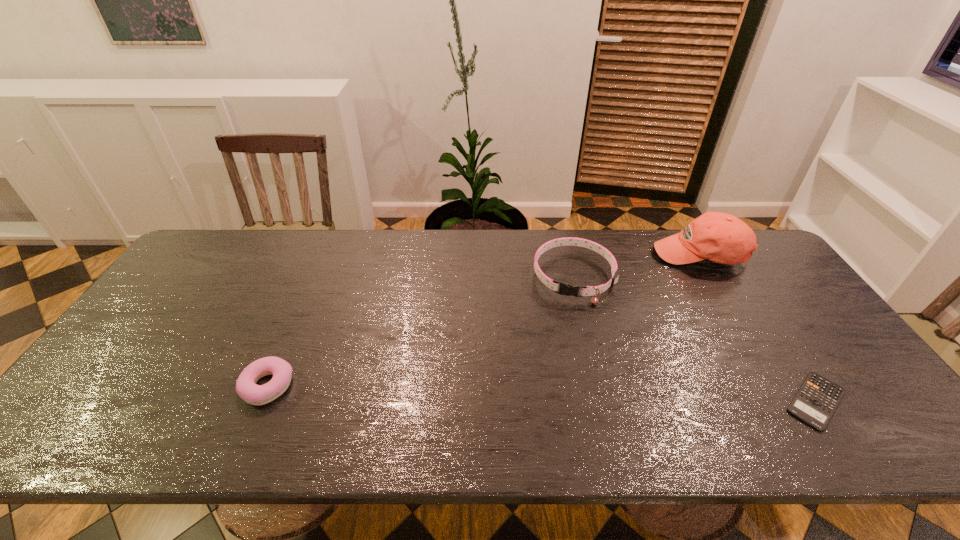
Locate an element on the screen. vacant space located 0.350m on the front-facing side of the tallest object is located at coordinates (639, 338).

Where is `vacant space situated with the buckle on the third shortest object`? The height and width of the screenshot is (540, 960). vacant space situated with the buckle on the third shortest object is located at coordinates (550, 411).

Where is `blank space located 0.140m with the buckle on the third shortest object`? The image size is (960, 540). blank space located 0.140m with the buckle on the third shortest object is located at coordinates (563, 341).

Identify the location of free point located 0.240m with the buckle on the third shortest object. (557, 371).

You are a GUI agent. You are given a task and a screenshot of the screen. Output one action in this format:
    pyautogui.click(x=<x>, y=<y>)
    Task: Click on the baseball cap positioned at the far edge
    
    Given the screenshot: What is the action you would take?
    pyautogui.click(x=719, y=237)

You are a GUI agent. You are given a task and a screenshot of the screen. Output one action in this format:
    pyautogui.click(x=<x>, y=<y>)
    Task: Click on the dog collar that is at the far edge
    Image resolution: width=960 pixels, height=540 pixels.
    Given the screenshot: What is the action you would take?
    pyautogui.click(x=566, y=289)

Where is `pastry that is at the near edge`? This screenshot has height=540, width=960. pastry that is at the near edge is located at coordinates (246, 387).

Locate an element on the screen. calculator present at the near edge is located at coordinates (817, 399).

Locate an element on the screen. calculator that is at the right edge is located at coordinates (817, 399).

This screenshot has width=960, height=540. In order to click on baseball cap present at the right edge in this screenshot , I will do `click(719, 237)`.